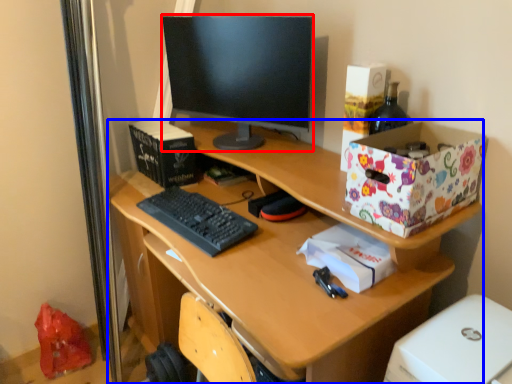
Question: Which of the following is the closest to the observer, television (highlighted by a red box) or desk (highlighted by a blue box)?

Choices:
 (A) television
 (B) desk

Answer: (B)